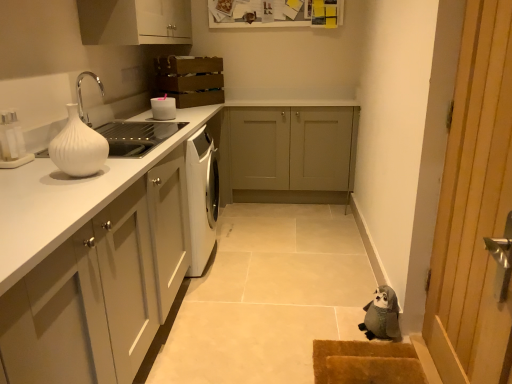
What are the coordinates of `vacant region above matte gray cabinet at center, the 3th cabinetry positioned from the front (from a real-world perspective)` in the screenshot? It's located at (283, 100).